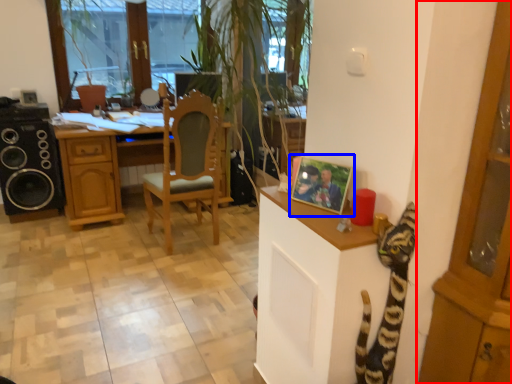
Question: Among these objects, which one is nearest to the camera, cabinetry (highlighted by a red box) or picture frame (highlighted by a blue box)?

Choices:
 (A) cabinetry
 (B) picture frame

Answer: (A)